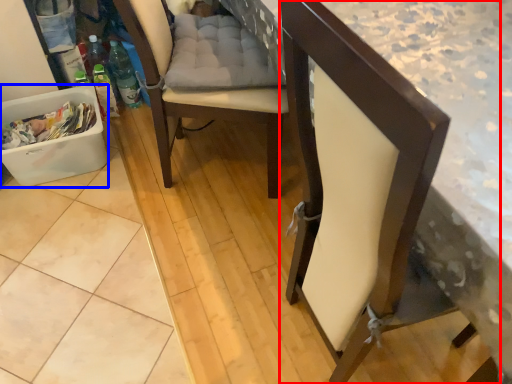
Question: Which point is further to the camera, chair (highlighted by a red box) or laundry basket (highlighted by a blue box)?

Choices:
 (A) chair
 (B) laundry basket

Answer: (B)